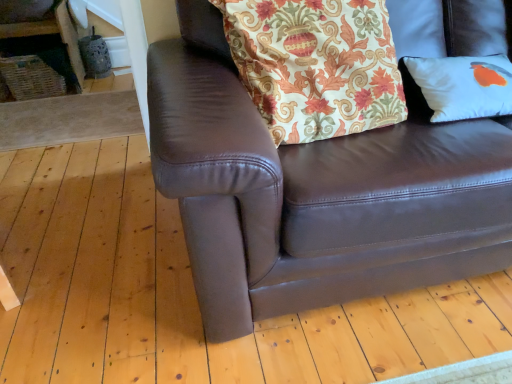
The height and width of the screenshot is (384, 512). What do you see at coordinates (315, 192) in the screenshot?
I see `brown leather couch at center` at bounding box center [315, 192].

The width and height of the screenshot is (512, 384). What do you see at coordinates (316, 65) in the screenshot?
I see `floral fabric pillow at upper center` at bounding box center [316, 65].

This screenshot has width=512, height=384. Find the location of `brown leather couch at center`. brown leather couch at center is located at coordinates (315, 192).

Is white matte pillow at right to the left or to the right of floral fabric pillow at upper center in the image?

Based on their positions, white matte pillow at right is located to the right of floral fabric pillow at upper center.

Which object is closer to the camera, white matte pillow at right or floral fabric pillow at upper center?

floral fabric pillow at upper center is closer to the camera.

Based on the photo, is white matte pillow at right inside the boundaries of floral fabric pillow at upper center, or outside?

white matte pillow at right is located beyond the bounds of floral fabric pillow at upper center.

Which of these two, white matte pillow at right or floral fabric pillow at upper center, is wider?

With larger width is floral fabric pillow at upper center.

From a real-world perspective, is brown leather couch at center above or below white matte pillow at right?

brown leather couch at center is below white matte pillow at right.

Does point (426, 283) come behind point (476, 84)?

No, (426, 283) is in front of (476, 84).

Is white matte pillow at right a part of brown leather couch at center?

Yes, white matte pillow at right is inside brown leather couch at center.

Is brown leather couch at center thinner than floral fabric pillow at upper center?

Incorrect, the width of brown leather couch at center is not less than that of floral fabric pillow at upper center.

Does point (245, 159) come behind point (328, 44)?

No, (245, 159) is in front of (328, 44).

Measure the distance between brown leather couch at center and floral fabric pillow at upper center.

brown leather couch at center and floral fabric pillow at upper center are 8.91 inches apart.

Is brown leather couch at center looking in the opposite direction of floral fabric pillow at upper center?

Yes.

This screenshot has width=512, height=384. I want to click on blanket on the left of brown leather couch at center, so click(316, 65).

Looking at this image, could brown leather couch at center be considered to be inside floral fabric pillow at upper center?

No, floral fabric pillow at upper center does not contain brown leather couch at center.

Is floral fabric pillow at upper center in front of or behind brown leather couch at center in the image?

floral fabric pillow at upper center is positioned farther from the viewer than brown leather couch at center.

How many degrees apart are the facing directions of floral fabric pillow at upper center and white matte pillow at right?

floral fabric pillow at upper center and white matte pillow at right are facing 4.28 degrees away from each other.

From the image's perspective, is floral fabric pillow at upper center on white matte pillow at right?

Correct, floral fabric pillow at upper center appears higher than white matte pillow at right in the image.

Is floral fabric pillow at upper center with white matte pillow at right?

floral fabric pillow at upper center and white matte pillow at right are clearly separated.

This screenshot has width=512, height=384. I want to click on blanket located on the left of white matte pillow at right, so click(316, 65).

Looking at the image, does white matte pillow at right seem bigger or smaller compared to brown leather couch at center?

In the image, white matte pillow at right appears to be smaller than brown leather couch at center.

Do you think white matte pillow at right is within brown leather couch at center, or outside of it?

white matte pillow at right is enclosed within brown leather couch at center.

I want to click on pillow on the right of floral fabric pillow at upper center, so click(463, 86).

Where is `pillow positioned vertically above the brown leather couch at center (from a real-world perspective)`? Image resolution: width=512 pixels, height=384 pixels. pillow positioned vertically above the brown leather couch at center (from a real-world perspective) is located at coordinates (463, 86).

When comparing their distances from white matte pillow at right, does brown leather couch at center or floral fabric pillow at upper center seem further?

brown leather couch at center is further to white matte pillow at right.

Considering their positions, is white matte pillow at right positioned further to floral fabric pillow at upper center than brown leather couch at center?

The object further to floral fabric pillow at upper center is white matte pillow at right.

From the image, which object appears to be nearer to brown leather couch at center, floral fabric pillow at upper center or white matte pillow at right?

Based on the image, floral fabric pillow at upper center appears to be nearer to brown leather couch at center.

Which object lies further to the anchor point white matte pillow at right, floral fabric pillow at upper center or brown leather couch at center?

brown leather couch at center.

Looking at the image, which one is located closer to brown leather couch at center, white matte pillow at right or floral fabric pillow at upper center?

floral fabric pillow at upper center is closer to brown leather couch at center.

From the image, which object appears to be farther from floral fabric pillow at upper center, brown leather couch at center or white matte pillow at right?

white matte pillow at right is further to floral fabric pillow at upper center.

Find the location of a particular element. The image size is (512, 384). blanket positioned between brown leather couch at center and white matte pillow at right from near to far is located at coordinates (316, 65).